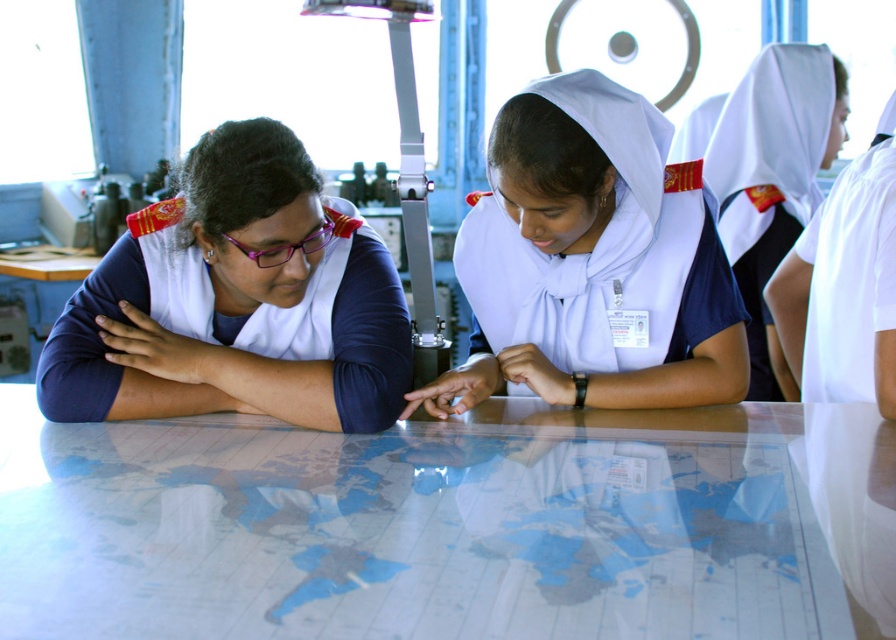
You are observing a group of people in uniforms at a table. You notice two uniforms labeled as the white matte uniform at center and the white uniform at upper right. Which of these two uniforms is shorter in height?

The white matte uniform at center is shorter in height compared to the white uniform at upper right because it is not as tall as the latter.

From the picture: You are a photographer standing in front of the table where the group is working. You need to capture a clear photo of both the white matte uniform at center and the white uniform at upper right. Which uniform will appear larger in the photo?

The white matte uniform at center will appear larger in the photo because it is closer to the viewer than the white uniform at upper right.